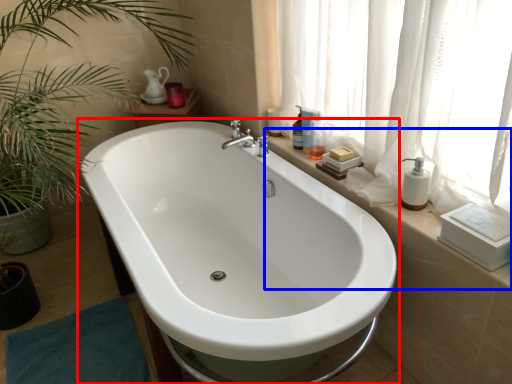
Question: Among these objects, which one is nearest to the camera, bathtub (highlighted by a red box) or window sill (highlighted by a blue box)?

Choices:
 (A) bathtub
 (B) window sill

Answer: (A)